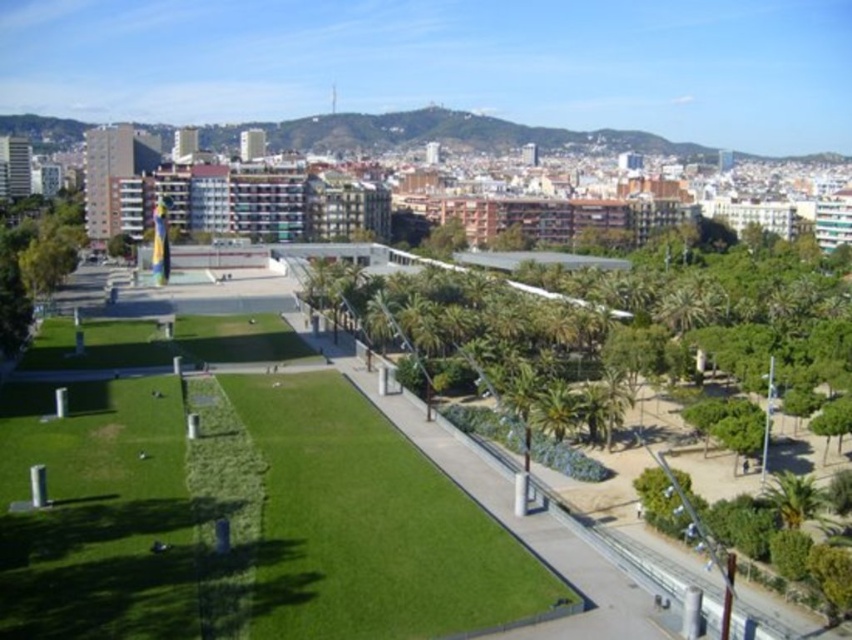
I want to click on green grass at center, so click(240, 518).

Find the location of a particular element. Image resolution: width=852 pixels, height=640 pixels. green grass at center is located at coordinates (240, 518).

Is green grass at center to the left of green leafy tree at center from the viewer's perspective?

Correct, you'll find green grass at center to the left of green leafy tree at center.

In the scene shown: Which of these two, green grass at center or green leafy tree at center, stands taller?

Standing taller between the two is green leafy tree at center.

Who is more forward, (381, 509) or (528, 451)?

Point (381, 509)

The height and width of the screenshot is (640, 852). What are the coordinates of `green grass at center` in the screenshot? It's located at coord(240,518).

Can you confirm if green leafy tree at center is shorter than green leafy tree at left?

Indeed, green leafy tree at center has a lesser height compared to green leafy tree at left.

Does green leafy tree at center appear on the right side of green leafy tree at left?

Indeed, green leafy tree at center is positioned on the right side of green leafy tree at left.

You are a GUI agent. You are given a task and a screenshot of the screen. Output one action in this format:
    pyautogui.click(x=<x>, y=<y>)
    Task: Click on the green leafy tree at center
    The width and height of the screenshot is (852, 640).
    Given the screenshot: What is the action you would take?
    pyautogui.click(x=446, y=314)